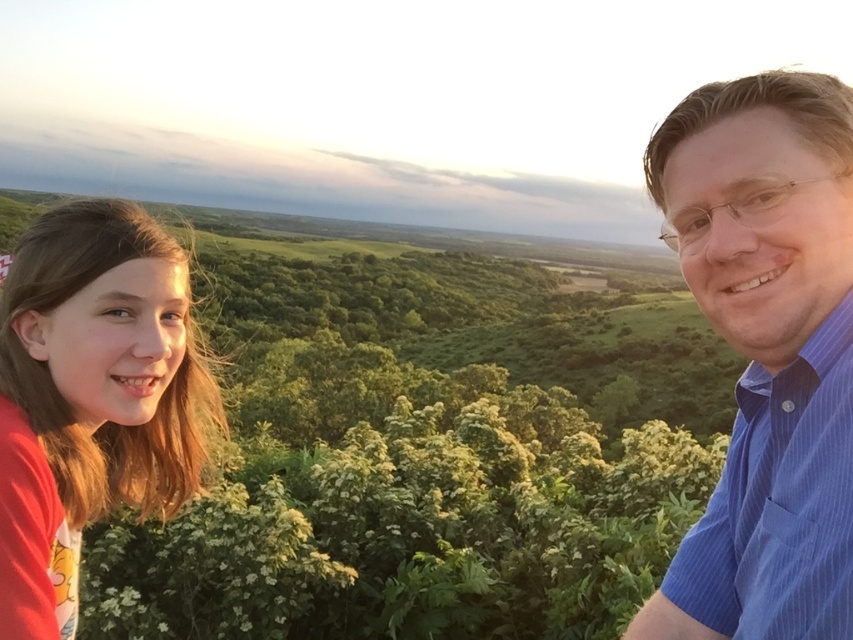
You are a photographer trying to capture a clear shot of the blue striped shirt at upper right and the red cotton shirt at left. Since you want both shirts to be in focus, which one should you focus on first to ensure the other is also sharp?

You should focus on the red cotton shirt at left first because it is behind the blue striped shirt at upper right, ensuring both will be in focus.

You are a photographer trying to capture a closeup of the blue striped shirt at upper right and the red cotton shirt at left. Since you want both shirts to be in focus, which one should you adjust your camera focus to prioritize first?

The blue striped shirt at upper right is larger in size than the red cotton shirt at left, so you should prioritize focusing on the blue striped shirt at upper right first to ensure it is in focus.